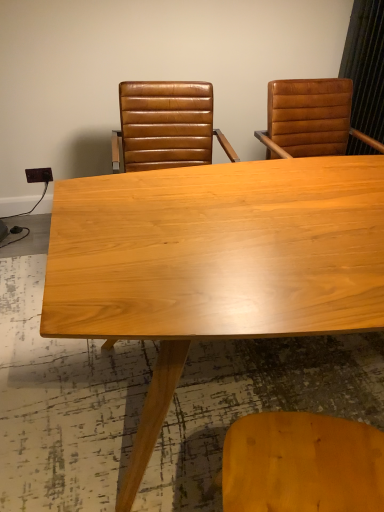
Question: Is leather at right, the second chair positioned from the left, far from brown leather chair at upper center, which ranks as the 2th chair in right-to-left order?

Choices:
 (A) yes
 (B) no

Answer: (B)

Question: Is the position of leather at right, the second chair positioned from the left, more distant than that of brown leather chair at upper center, which appears as the first chair when viewed from the left?

Choices:
 (A) no
 (B) yes

Answer: (B)

Question: Can you confirm if leather at right, the 1th chair when ordered from right to left, is taller than brown leather chair at upper center, which ranks as the 2th chair in right-to-left order?

Choices:
 (A) yes
 (B) no

Answer: (B)

Question: Does leather at right, the 1th chair when ordered from right to left, have a lesser height compared to brown leather chair at upper center, which ranks as the 2th chair in right-to-left order?

Choices:
 (A) no
 (B) yes

Answer: (B)

Question: Could you tell me if leather at right, the second chair positioned from the left, is turned towards brown leather chair at upper center, which appears as the first chair when viewed from the left?

Choices:
 (A) no
 (B) yes

Answer: (A)

Question: Considering the relative positions of light wood table at center and leather at right, the 1th chair when ordered from right to left, in the image provided, is light wood table at center to the left or to the right of leather at right, the 1th chair when ordered from right to left,?

Choices:
 (A) left
 (B) right

Answer: (A)

Question: In the image, is light wood table at center positioned in front of or behind leather at right, the 1th chair when ordered from right to left?

Choices:
 (A) front
 (B) behind

Answer: (A)

Question: Considering the positions of light wood table at center and leather at right, the second chair positioned from the left, in the image, is light wood table at center bigger or smaller than leather at right, the second chair positioned from the left,?

Choices:
 (A) big
 (B) small

Answer: (A)

Question: Which is correct: light wood table at center is inside leather at right, the second chair positioned from the left, or outside of it?

Choices:
 (A) inside
 (B) outside

Answer: (B)

Question: Considering the relative positions of light wood table at center and brown leather chair at upper center, which ranks as the 2th chair in right-to-left order, in the image provided, is light wood table at center to the left or to the right of brown leather chair at upper center, which ranks as the 2th chair in right-to-left order,?

Choices:
 (A) left
 (B) right

Answer: (B)

Question: In the image, is light wood table at center positioned in front of or behind brown leather chair at upper center, which ranks as the 2th chair in right-to-left order?

Choices:
 (A) front
 (B) behind

Answer: (A)

Question: In terms of height, does light wood table at center look taller or shorter compared to brown leather chair at upper center, which ranks as the 2th chair in right-to-left order?

Choices:
 (A) short
 (B) tall

Answer: (B)

Question: Do you think light wood table at center is within brown leather chair at upper center, which ranks as the 2th chair in right-to-left order, or outside of it?

Choices:
 (A) inside
 (B) outside

Answer: (B)

Question: From their relative heights in the image, would you say leather at right, the second chair positioned from the left, is taller or shorter than brown leather chair at upper center, which appears as the first chair when viewed from the left?

Choices:
 (A) tall
 (B) short

Answer: (B)

Question: From the image's perspective, is leather at right, the 1th chair when ordered from right to left, located above or below brown leather chair at upper center, which ranks as the 2th chair in right-to-left order?

Choices:
 (A) below
 (B) above

Answer: (B)